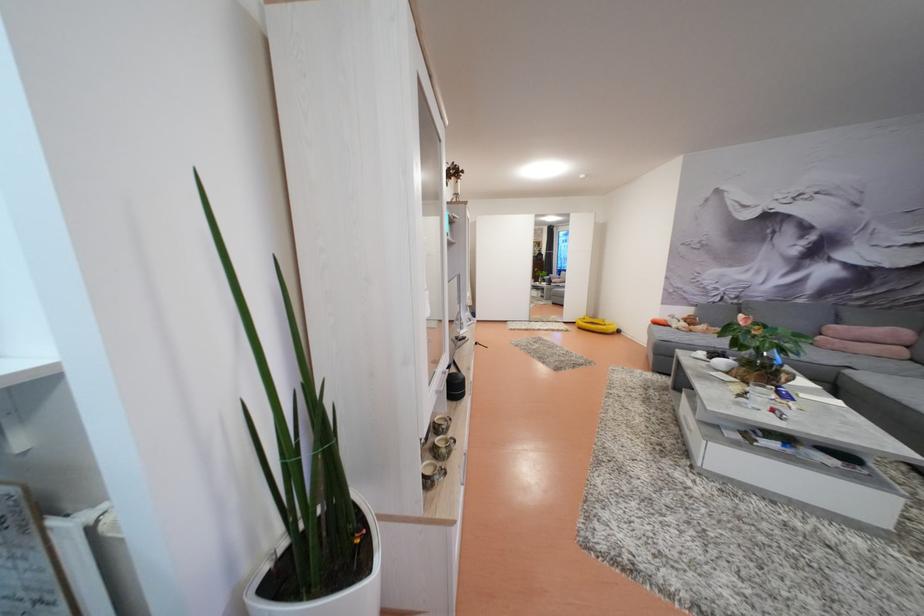
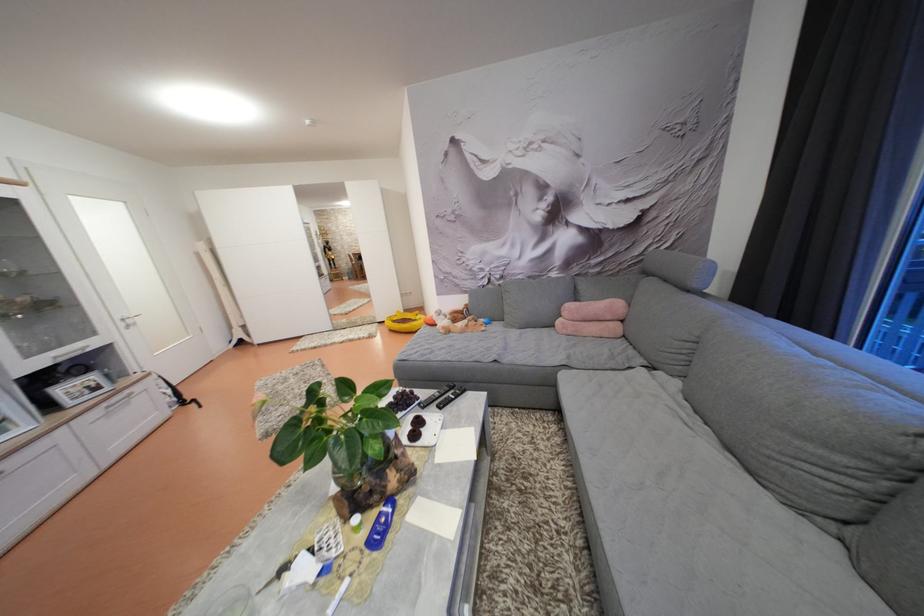
The images are taken continuously from a first-person perspective. In which direction are you moving?

The cameraman moved toward right, forward.